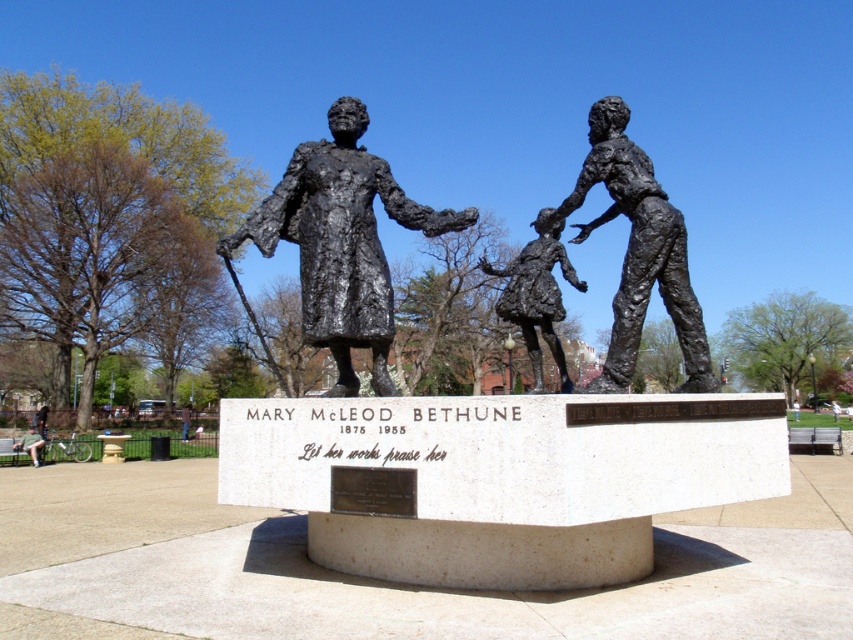
You are a park visitor who wants to sit on the green fabric bench at lower left while still being able to see the bronze statue at center. Is the bench positioned in a way that allows you to view the statue without obstruction?

The bronze statue at center is positioned over the green fabric bench at lower left, so the statue is directly above the bench. This means you can sit on the green fabric bench at lower left and still see the bronze statue at center clearly without any obstruction.

You are a visitor at the park and want to take a photo of the bronze statue at center with the green fabric bench at lower left in the background. Will the bench be fully visible in the photo if you stand close to the statue?

The bronze statue at center is taller than the green fabric bench at lower left, so if you stand close to the statue, part of the bench might be blocked by the statue, making it not fully visible in the photo.